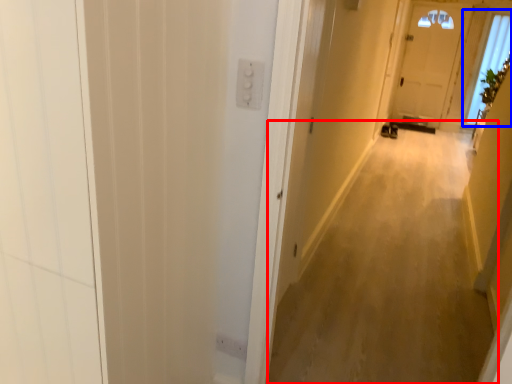
Question: Among these objects, which one is nearest to the camera, corridor (highlighted by a red box) or window (highlighted by a blue box)?

Choices:
 (A) corridor
 (B) window

Answer: (A)